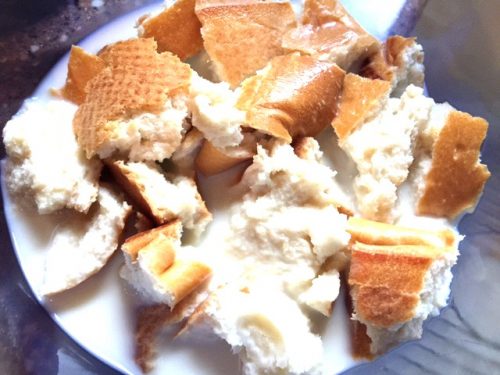
The height and width of the screenshot is (375, 500). In order to click on light in this screenshot , I will do `click(388, 16)`.